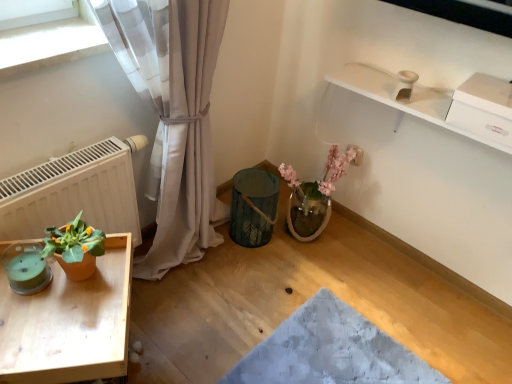
Question: Should I look upward or downward to see wooden tray at lower left?

Choices:
 (A) down
 (B) up

Answer: (A)

Question: Does wooden tray at lower left have a larger size compared to terracotta pot at left?

Choices:
 (A) no
 (B) yes

Answer: (B)

Question: Is wooden tray at lower left taller than terracotta pot at left?

Choices:
 (A) yes
 (B) no

Answer: (A)

Question: Is the depth of wooden tray at lower left less than that of terracotta pot at left?

Choices:
 (A) no
 (B) yes

Answer: (B)

Question: Is terracotta pot at left at the back of wooden tray at lower left?

Choices:
 (A) no
 (B) yes

Answer: (A)

Question: From a real-world perspective, is wooden tray at lower left positioned under terracotta pot at left based on gravity?

Choices:
 (A) no
 (B) yes

Answer: (B)

Question: From a real-world perspective, is wooden tray at lower left on terracotta pot at left?

Choices:
 (A) yes
 (B) no

Answer: (B)

Question: From the image's perspective, would you say white matte radiator at left is positioned over wooden tray at lower left?

Choices:
 (A) yes
 (B) no

Answer: (A)

Question: Considering the relative positions of white matte radiator at left and wooden tray at lower left in the image provided, is white matte radiator at left behind wooden tray at lower left?

Choices:
 (A) yes
 (B) no

Answer: (A)

Question: Is white matte radiator at left with wooden tray at lower left?

Choices:
 (A) no
 (B) yes

Answer: (A)

Question: Can you confirm if white matte radiator at left is thinner than wooden tray at lower left?

Choices:
 (A) no
 (B) yes

Answer: (B)

Question: Is white matte radiator at left outside of wooden tray at lower left?

Choices:
 (A) yes
 (B) no

Answer: (A)

Question: Considering the relative sizes of white matte radiator at left and wooden tray at lower left in the image provided, is white matte radiator at left smaller than wooden tray at lower left?

Choices:
 (A) no
 (B) yes

Answer: (B)

Question: Can you confirm if teal glass candle at lower left is taller than wooden tray at lower left?

Choices:
 (A) no
 (B) yes

Answer: (A)